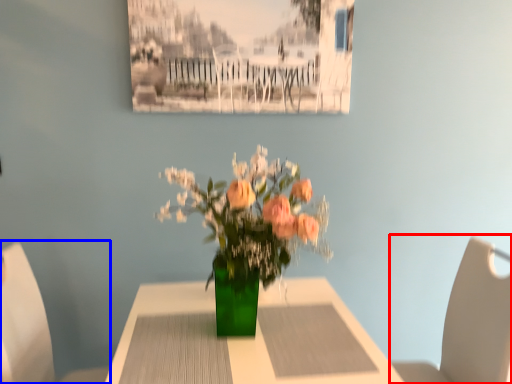
Question: Among these objects, which one is nearest to the camera, chair (highlighted by a red box) or chair (highlighted by a blue box)?

Choices:
 (A) chair
 (B) chair

Answer: (B)